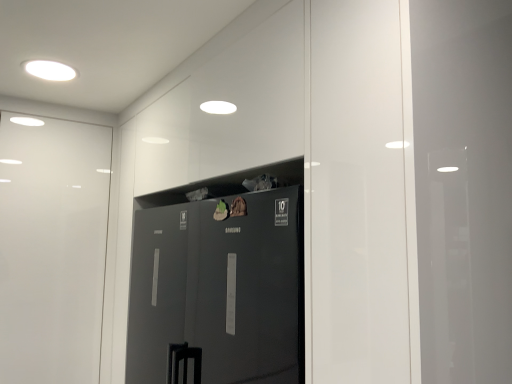
What is the approximate height of white glossy light fixture at upper left?

It is 0.74 inches.

Identify the location of white glossy light fixture at upper left. The width and height of the screenshot is (512, 384). (50, 70).

What do you see at coordinates (50, 70) in the screenshot? The width and height of the screenshot is (512, 384). I see `white glossy light fixture at upper left` at bounding box center [50, 70].

Image resolution: width=512 pixels, height=384 pixels. What do you see at coordinates (218, 291) in the screenshot?
I see `glossy black refrigerator at center` at bounding box center [218, 291].

This screenshot has height=384, width=512. Identify the location of glossy black refrigerator at center. (218, 291).

Where is `white glossy light fixture at upper left`? white glossy light fixture at upper left is located at coordinates (50, 70).

Visually, is white glossy light fixture at upper left positioned to the left or to the right of glossy black refrigerator at center?

Based on their positions, white glossy light fixture at upper left is located to the left of glossy black refrigerator at center.

Consider the image. Which object is closer to the camera taking this photo, white glossy light fixture at upper left or glossy black refrigerator at center?

glossy black refrigerator at center is closer to the camera.

Which is closer, (51,80) or (227,330)?

The point (227,330) is closer.

From the image's perspective, is white glossy light fixture at upper left below glossy black refrigerator at center?

Actually, white glossy light fixture at upper left appears above glossy black refrigerator at center in the image.

From a real-world perspective, which object rests below the other?

glossy black refrigerator at center.

Is white glossy light fixture at upper left thinner than glossy black refrigerator at center?

Yes.

Who is taller, white glossy light fixture at upper left or glossy black refrigerator at center?

glossy black refrigerator at center is taller.

Which of these two, white glossy light fixture at upper left or glossy black refrigerator at center, is bigger?

glossy black refrigerator at center.

Is white glossy light fixture at upper left completely or partially outside of glossy black refrigerator at center?

That's correct, white glossy light fixture at upper left is outside of glossy black refrigerator at center.

Is white glossy light fixture at upper left positioned far away from glossy black refrigerator at center?

No, there isn't a large distance between white glossy light fixture at upper left and glossy black refrigerator at center.

Is glossy black refrigerator at center at the back of white glossy light fixture at upper left?

No, white glossy light fixture at upper left is not facing away from glossy black refrigerator at center.

This screenshot has height=384, width=512. Find the location of `lighting above the glossy black refrigerator at center (from a real-world perspective)`. lighting above the glossy black refrigerator at center (from a real-world perspective) is located at coordinates (50, 70).

Between glossy black refrigerator at center and white glossy light fixture at upper left, which one appears on the right side from the viewer's perspective?

Positioned to the right is glossy black refrigerator at center.

Is glossy black refrigerator at center in front of or behind white glossy light fixture at upper left in the image?

Clearly, glossy black refrigerator at center is in front of white glossy light fixture at upper left.

Is point (229, 223) positioned after point (71, 73)?

No, it is in front of (71, 73).

From the image's perspective, which object appears higher, glossy black refrigerator at center or white glossy light fixture at upper left?

white glossy light fixture at upper left is shown above in the image.

From a real-world perspective, is glossy black refrigerator at center over white glossy light fixture at upper left?

Actually, glossy black refrigerator at center is physically below white glossy light fixture at upper left in the real world.

Consider the image. Considering the sizes of objects glossy black refrigerator at center and white glossy light fixture at upper left in the image provided, who is thinner, glossy black refrigerator at center or white glossy light fixture at upper left?

white glossy light fixture at upper left is thinner.

Is glossy black refrigerator at center shorter than white glossy light fixture at upper left?

No.

Who is bigger, glossy black refrigerator at center or white glossy light fixture at upper left?

glossy black refrigerator at center is bigger.

Is glossy black refrigerator at center spatially inside white glossy light fixture at upper left, or outside of it?

glossy black refrigerator at center cannot be found inside white glossy light fixture at upper left.

Is glossy black refrigerator at center next to white glossy light fixture at upper left and touching it?

No.

Could you tell me if glossy black refrigerator at center is turned towards white glossy light fixture at upper left?

No.

The width and height of the screenshot is (512, 384). In order to click on lighting above the glossy black refrigerator at center (from a real-world perspective) in this screenshot , I will do `click(50, 70)`.

Locate an element on the screen. lighting that is behind the glossy black refrigerator at center is located at coordinates (50, 70).

Where is `door lying below the white glossy light fixture at upper left (from the image's perspective)`? The height and width of the screenshot is (384, 512). door lying below the white glossy light fixture at upper left (from the image's perspective) is located at coordinates (218, 291).